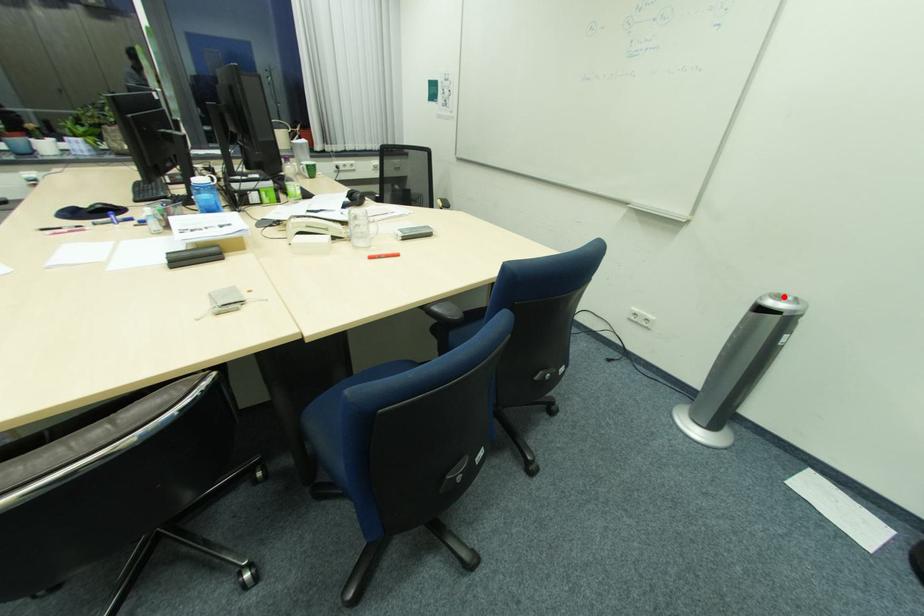
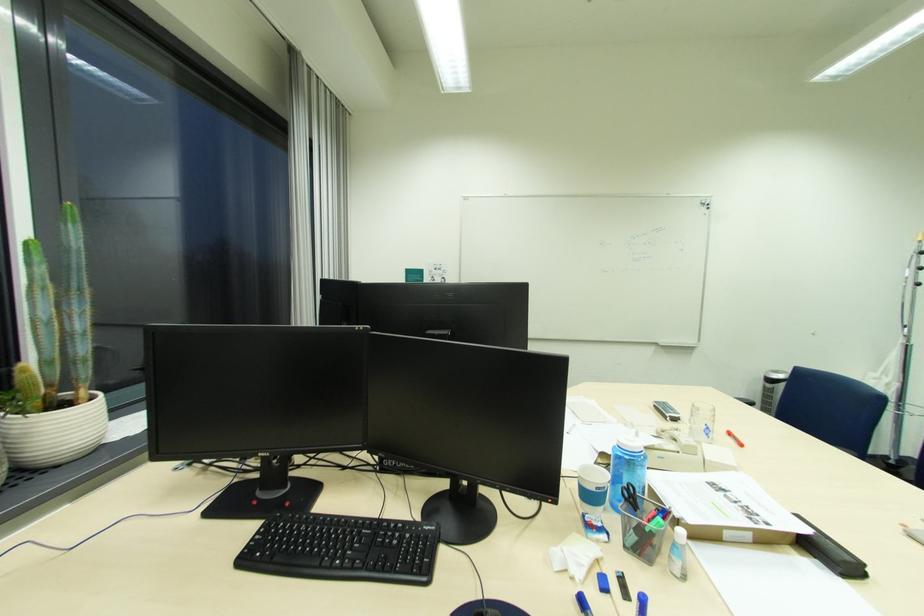
Question: I am providing you with two images of the same scene from different viewpoints. Image1 has a red point marked. In image2, the corresponding 3D location appears at what relative position? Reply with the corresponding letter.

Choices:
 (A) Closer
 (B) Farther

Answer: (B)